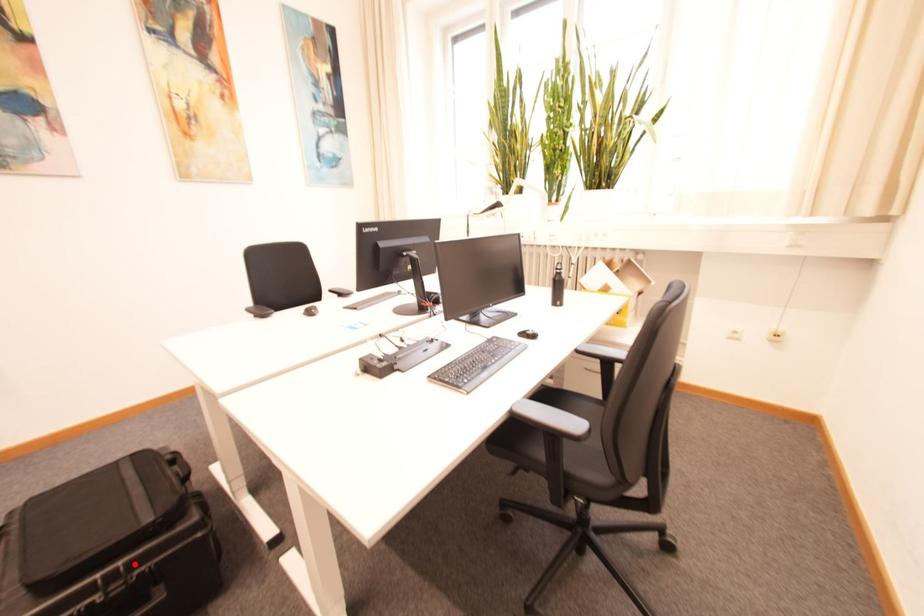
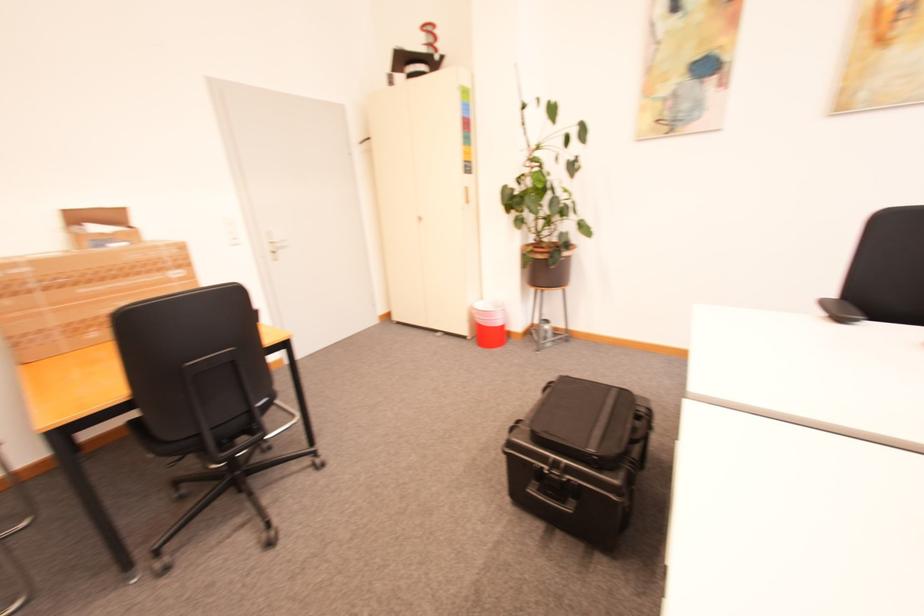
In the second image, find the point that corresponds to the highlighted location in the first image.

(574, 467)